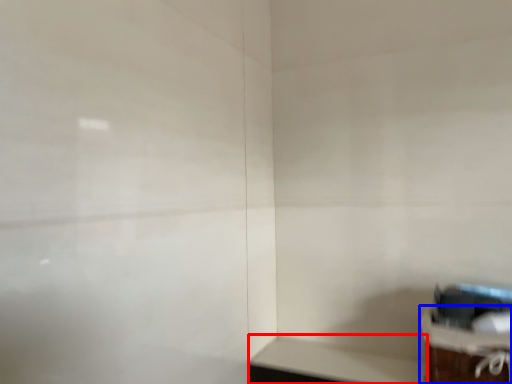
Question: Among these objects, which one is farthest to the camera, table (highlighted by a red box) or furniture (highlighted by a blue box)?

Choices:
 (A) table
 (B) furniture

Answer: (A)